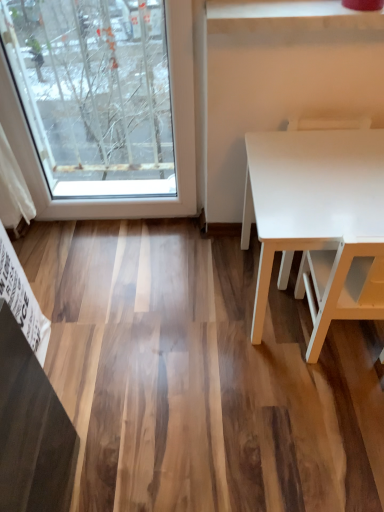
Question: Is white glossy chair at right wider than white glossy table at right?

Choices:
 (A) yes
 (B) no

Answer: (B)

Question: From the image's perspective, is white glossy chair at right on top of white glossy table at right?

Choices:
 (A) yes
 (B) no

Answer: (A)

Question: From a real-world perspective, is white glossy chair at right physically below white glossy table at right?

Choices:
 (A) no
 (B) yes

Answer: (A)

Question: Does white glossy chair at right have a smaller size compared to white glossy table at right?

Choices:
 (A) yes
 (B) no

Answer: (A)

Question: Does white glossy chair at right come behind white glossy table at right?

Choices:
 (A) no
 (B) yes

Answer: (B)

Question: Is white glossy table at right at the back of white glossy chair at right?

Choices:
 (A) yes
 (B) no

Answer: (A)

Question: Is white glossy table at right wider than white glossy chair at right?

Choices:
 (A) yes
 (B) no

Answer: (A)

Question: Can you confirm if white glossy table at right is shorter than white glossy chair at right?

Choices:
 (A) yes
 (B) no

Answer: (A)

Question: Are white glossy table at right and white glossy chair at right making contact?

Choices:
 (A) no
 (B) yes

Answer: (A)

Question: Is white glossy table at right positioned before white glossy chair at right?

Choices:
 (A) yes
 (B) no

Answer: (A)

Question: From the image's perspective, is white glossy table at right below white glossy chair at right?

Choices:
 (A) yes
 (B) no

Answer: (A)

Question: Does white glossy table at right come behind white glossy chair at right?

Choices:
 (A) no
 (B) yes

Answer: (A)

Question: Looking at the image, does white glossy chair at right seem bigger or smaller compared to white glossy table at right?

Choices:
 (A) big
 (B) small

Answer: (B)